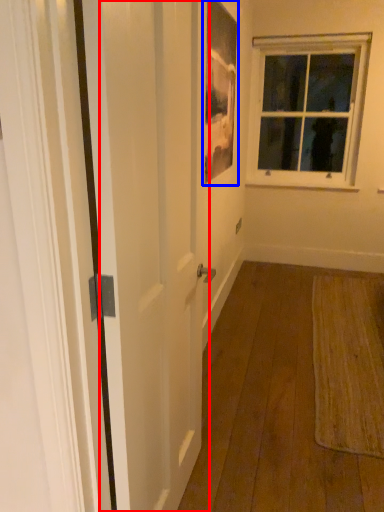
Question: Which object is closer to the camera taking this photo, screen door (highlighted by a red box) or picture frame (highlighted by a blue box)?

Choices:
 (A) screen door
 (B) picture frame

Answer: (A)